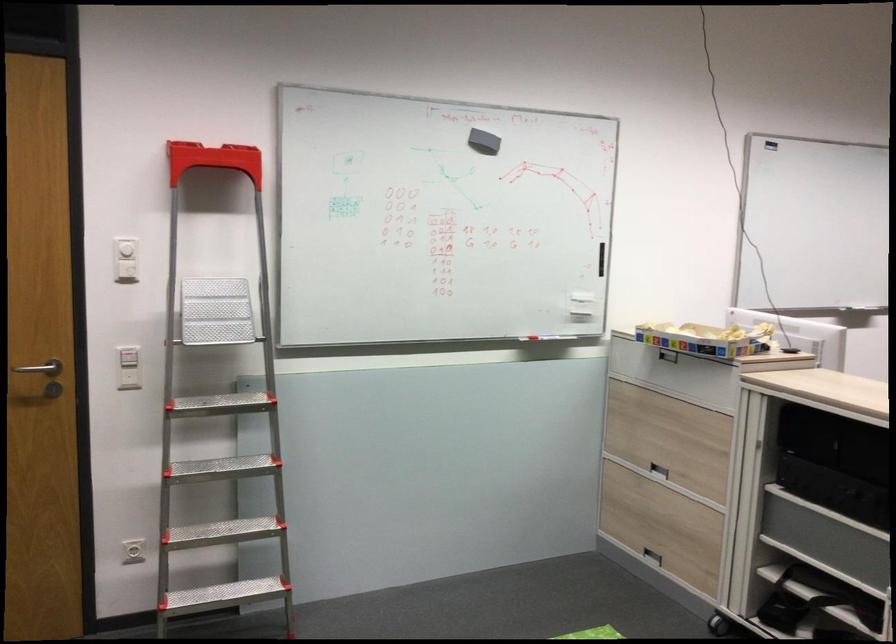
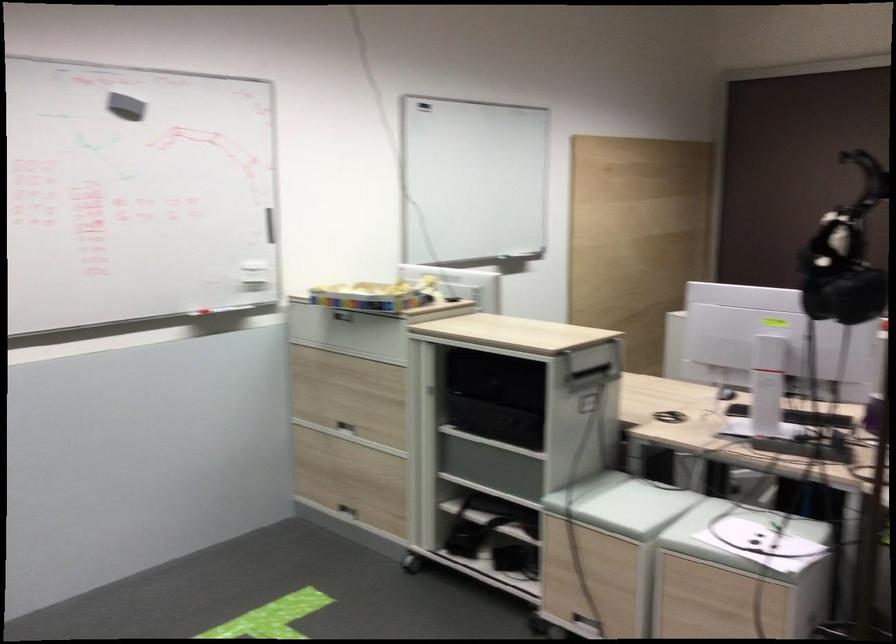
Question: Based on the continuous images, in which direction is the camera rotating? Reply with the corresponding letter.

Choices:
 (A) Left
 (B) Right
 (C) Up
 (D) Down

Answer: (B)